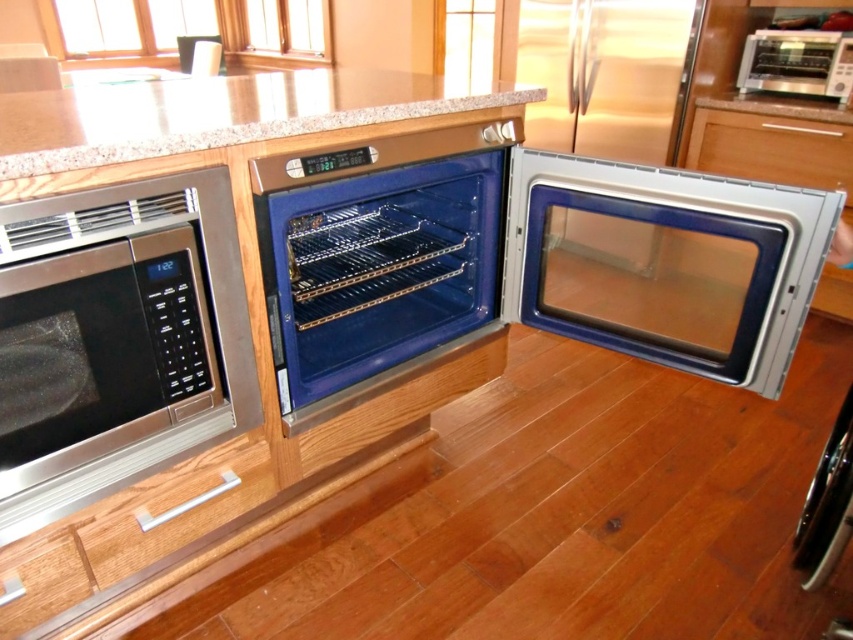
You are a chef preparing to place a large cutting board on the granite at upper center. You also have a smaller spice rack that needs to be placed near the satin wood drawer at center. Considering the widths of these surfaces, which surface can accommodate the larger item?

The granite at upper center has a greater width than the satin wood drawer at center, so the large cutting board should be placed on the granite at upper center while the smaller spice rack can fit on the satin wood drawer at center.

You are trying to place a large cutting board on the counter in the kitchen. The board is as wide as the white wood drawer at lower center. Will it fit entirely on the granite at upper center?

The granite at upper center is wider than the white wood drawer at lower center, so the cutting board will fit entirely on the granite at upper center.

You are trying to install a new shelf in the kitchen. The shelf is designed to fit between the satin silver oven at center and the white wood drawer at lower center. Given their heights, will the shelf fit vertically between them?

The satin silver oven at center has a greater height compared to the white wood drawer at lower center, so the shelf may not fit vertically between them since the oven is taller than the drawer, creating an uneven space.